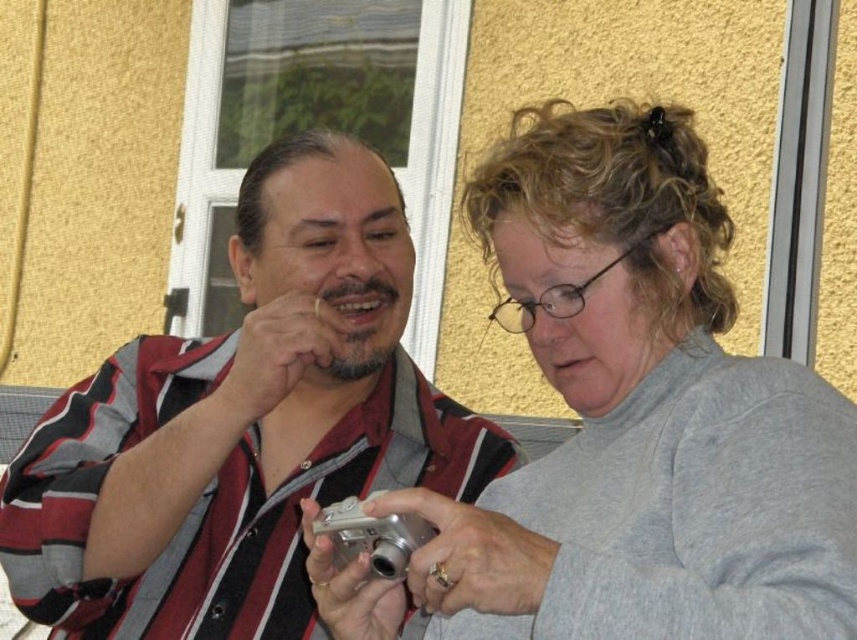
Question: Can you confirm if gray matte sweater at center is thinner than striped fabric shirt at center?

Choices:
 (A) yes
 (B) no

Answer: (A)

Question: Which point appears closest to the camera in this image?

Choices:
 (A) (854, 410)
 (B) (288, 362)

Answer: (A)

Question: Which point appears farthest from the camera in this image?

Choices:
 (A) (694, 198)
 (B) (196, 392)

Answer: (B)

Question: Among these objects, which one is nearest to the camera?

Choices:
 (A) striped fabric shirt at center
 (B) gray matte sweater at center

Answer: (B)

Question: Can you confirm if gray matte sweater at center is wider than striped fabric shirt at center?

Choices:
 (A) yes
 (B) no

Answer: (B)

Question: Can you confirm if gray matte sweater at center is positioned to the left of striped fabric shirt at center?

Choices:
 (A) no
 (B) yes

Answer: (A)